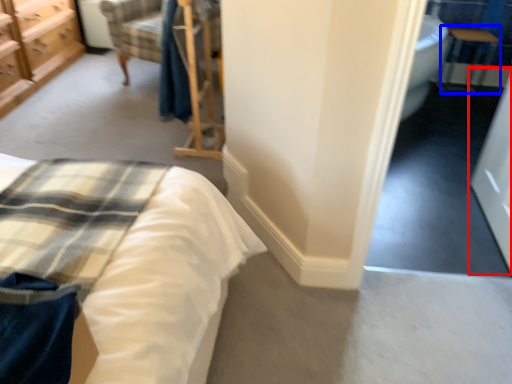
Question: Which object appears farthest to the camera in this image, screen door (highlighted by a red box) or table (highlighted by a blue box)?

Choices:
 (A) screen door
 (B) table

Answer: (B)